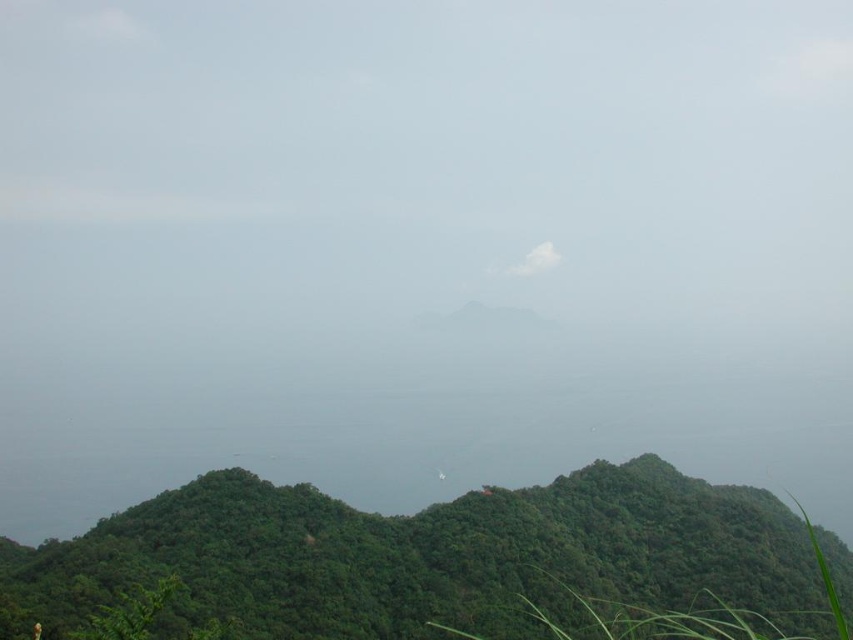
How far apart are green leafy vegetation at center and white fluffy cloud at center?

The distance of green leafy vegetation at center from white fluffy cloud at center is 457.02 meters.

Who is more forward, (204, 616) or (556, 259)?

Point (204, 616) is more forward.

Is point (769, 520) positioned after point (540, 269)?

That is False.

Find the location of a particular element. green leafy vegetation at center is located at coordinates (431, 556).